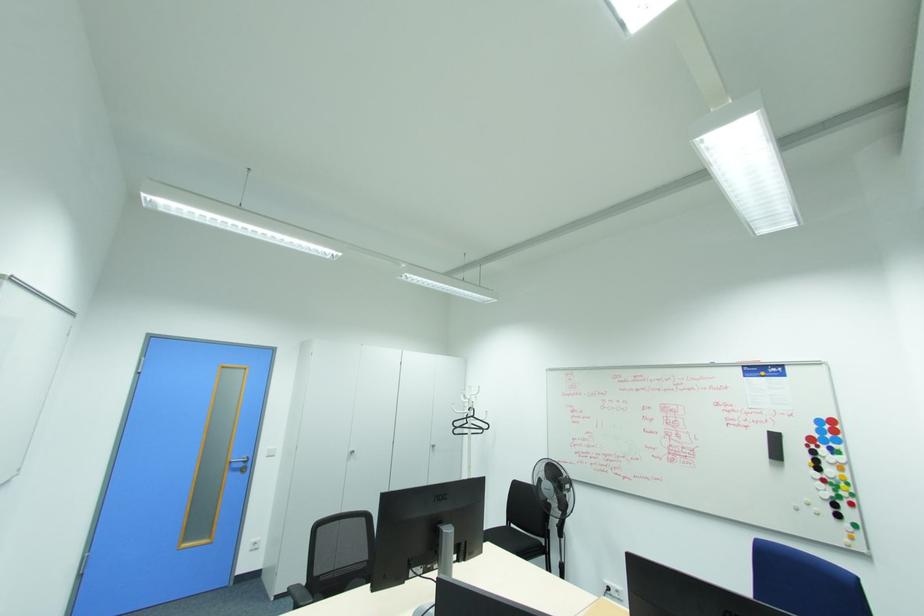
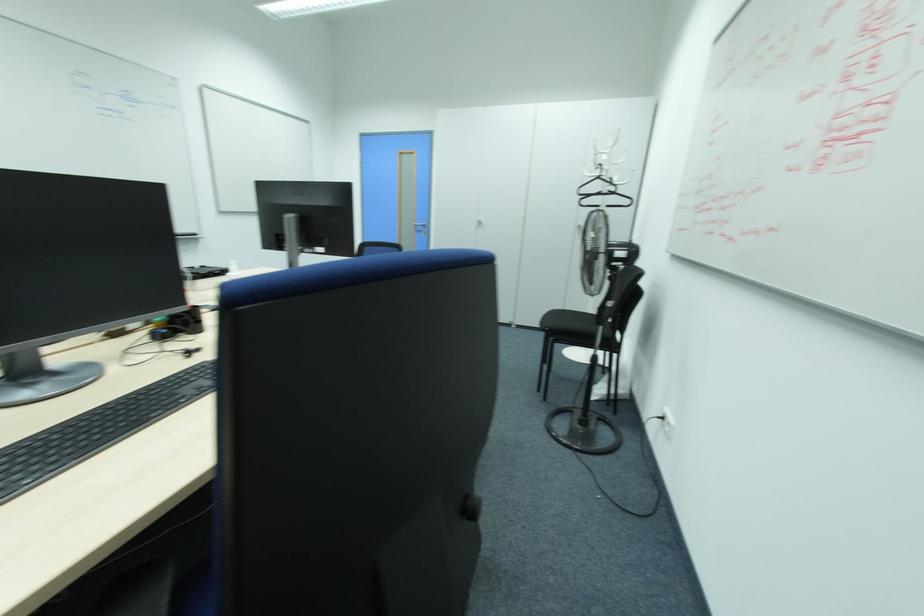
In the second image, find the point that corresponds to (473,416) in the first image.

(599, 177)